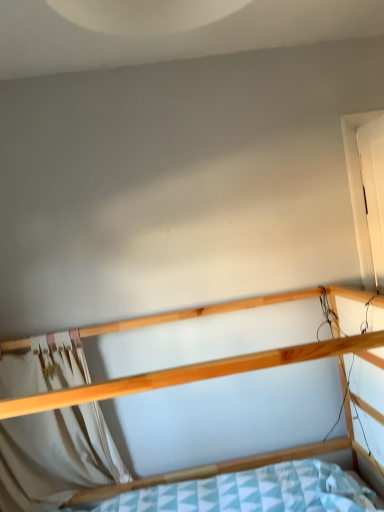
Question: Are white fabric curtain at lower left and white matte door at right located far from each other?

Choices:
 (A) yes
 (B) no

Answer: (A)

Question: From the image's perspective, is white fabric curtain at lower left located beneath white matte door at right?

Choices:
 (A) no
 (B) yes

Answer: (B)

Question: Is white fabric curtain at lower left further to the viewer compared to white matte door at right?

Choices:
 (A) yes
 (B) no

Answer: (A)

Question: Can you confirm if white fabric curtain at lower left is bigger than white matte door at right?

Choices:
 (A) yes
 (B) no

Answer: (A)

Question: Does white fabric curtain at lower left have a greater width compared to white matte door at right?

Choices:
 (A) no
 (B) yes

Answer: (A)

Question: Is white matte door at right wider or thinner than natural wood bed at center?

Choices:
 (A) wide
 (B) thin

Answer: (B)

Question: From the image's perspective, is white matte door at right above or below natural wood bed at center?

Choices:
 (A) below
 (B) above

Answer: (B)

Question: Considering their positions, is white matte door at right located in front of or behind natural wood bed at center?

Choices:
 (A) front
 (B) behind

Answer: (B)

Question: Based on their sizes in the image, would you say white matte door at right is bigger or smaller than natural wood bed at center?

Choices:
 (A) small
 (B) big

Answer: (A)

Question: Is white fabric curtain at lower left in front of or behind natural wood bed at center in the image?

Choices:
 (A) front
 (B) behind

Answer: (B)

Question: Would you say white fabric curtain at lower left is inside or outside natural wood bed at center?

Choices:
 (A) inside
 (B) outside

Answer: (A)

Question: From their relative heights in the image, would you say white fabric curtain at lower left is taller or shorter than natural wood bed at center?

Choices:
 (A) tall
 (B) short

Answer: (B)

Question: From a real-world perspective, is white fabric curtain at lower left physically located above or below natural wood bed at center?

Choices:
 (A) above
 (B) below

Answer: (A)

Question: Looking at their shapes, would you say white matte door at right is wider or thinner than white fabric curtain at lower left?

Choices:
 (A) thin
 (B) wide

Answer: (B)

Question: From the image's perspective, is white matte door at right positioned above or below white fabric curtain at lower left?

Choices:
 (A) above
 (B) below

Answer: (A)